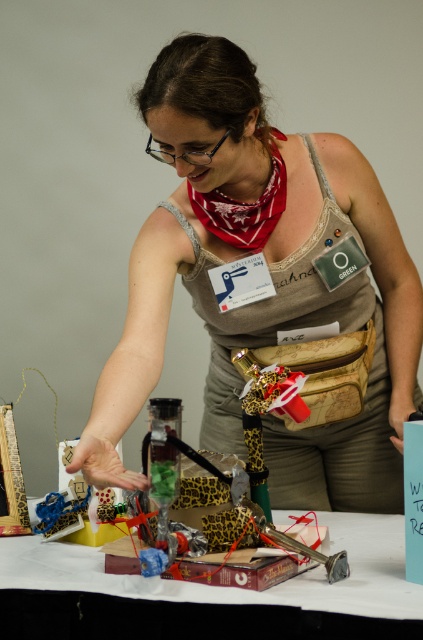
Question: Can you confirm if matte gray tank top at center is positioned above leopard print book at center?

Choices:
 (A) no
 (B) yes

Answer: (B)

Question: Which point is farther to the camera?

Choices:
 (A) (214, 362)
 (B) (93, 605)

Answer: (A)

Question: Which point is closer to the camera?

Choices:
 (A) matte gray tank top at center
 (B) leopard print book at center

Answer: (B)

Question: Does matte gray tank top at center appear over leopard print book at center?

Choices:
 (A) yes
 (B) no

Answer: (A)

Question: Can you confirm if matte gray tank top at center is thinner than leopard print book at center?

Choices:
 (A) yes
 (B) no

Answer: (A)